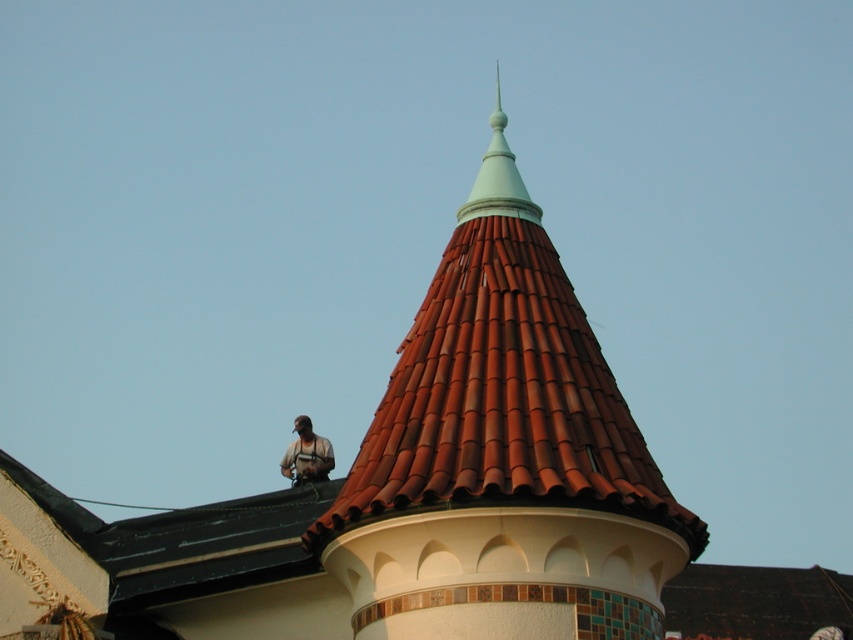
You are a maintenance worker needing to inspect both the brown tile roof at upper center and the light teal plastic spire at upper center. Given that your ladder can extend up to 10 meters, will you be able to reach both objects with the ladder?

The distance between the brown tile roof at upper center and the light teal plastic spire at upper center is 10.71 meters. Since the ladder can only extend to 10 meters, you will not be able to reach both objects with the ladder as the required distance exceeds the ladder capacity.

You are standing in front of a building and see both the brown tile roof at upper center and the camouflage fabric shirt at upper center. Which object is located to the right of the other?

The brown tile roof at upper center is positioned on the right side of camouflage fabric shirt at upper center.